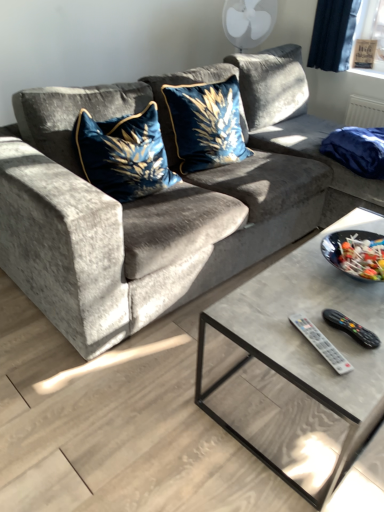
What do you see at coordinates (321, 343) in the screenshot? This screenshot has height=512, width=384. I see `white plastic remote at lower right, arranged as the first remote when viewed from the left` at bounding box center [321, 343].

Describe the element at coordinates (206, 124) in the screenshot. I see `velvet blue cushion at center, arranged as the second throw pillow when viewed from the left` at that location.

This screenshot has width=384, height=512. What do you see at coordinates (124, 154) in the screenshot?
I see `velvet blue pillow at center, the first throw pillow from the left` at bounding box center [124, 154].

This screenshot has width=384, height=512. In order to click on black plastic remote at lower right, which is counted as the first remote, starting from the right in this screenshot , I will do `click(351, 328)`.

Find the location of a particular element. This screenshot has width=384, height=512. white plastic remote at lower right, the 2th remote viewed from the right is located at coordinates (321, 343).

From a real-world perspective, is velvet blue pillow at center, the first throw pillow from the left, under black plastic remote at lower right, which is counted as the first remote, starting from the right?

Incorrect, from a real-world perspective, velvet blue pillow at center, the first throw pillow from the left, is higher than black plastic remote at lower right, which is counted as the first remote, starting from the right.

Is velvet blue pillow at center, which is the 2th throw pillow from right to left, wider or thinner than black plastic remote at lower right, marked as the second remote in a left-to-right arrangement?

velvet blue pillow at center, which is the 2th throw pillow from right to left, is wider than black plastic remote at lower right, marked as the second remote in a left-to-right arrangement.

Does velvet blue pillow at center, the first throw pillow from the left, appear on the right side of black plastic remote at lower right, which is counted as the first remote, starting from the right?

No, velvet blue pillow at center, the first throw pillow from the left, is not to the right of black plastic remote at lower right, which is counted as the first remote, starting from the right.

How different are the orientations of white plastic remote at lower right, arranged as the first remote when viewed from the left, and velvet blue pillow at center, the first throw pillow from the left, in degrees?

white plastic remote at lower right, arranged as the first remote when viewed from the left, and velvet blue pillow at center, the first throw pillow from the left, are facing 9.22 degrees away from each other.

Can you confirm if white plastic remote at lower right, the 2th remote viewed from the right, is thinner than velvet blue pillow at center, which is the 2th throw pillow from right to left?

Yes, white plastic remote at lower right, the 2th remote viewed from the right, is thinner than velvet blue pillow at center, which is the 2th throw pillow from right to left.

From the image's perspective, is white plastic remote at lower right, arranged as the first remote when viewed from the left, above or below velvet blue pillow at center, which is the 2th throw pillow from right to left?

Clearly, from the image's perspective, white plastic remote at lower right, arranged as the first remote when viewed from the left, is below velvet blue pillow at center, which is the 2th throw pillow from right to left.

Is white plastic remote at lower right, the 2th remote viewed from the right, positioned far away from velvet blue pillow at center, which is the 2th throw pillow from right to left?

white plastic remote at lower right, the 2th remote viewed from the right, is positioned a significant distance from velvet blue pillow at center, which is the 2th throw pillow from right to left.

From the image's perspective, which object appears higher, velvet gray couch at center or velvet blue pillow at center, which is the 2th throw pillow from right to left?

velvet blue pillow at center, which is the 2th throw pillow from right to left, appears higher in the image.

Is velvet gray couch at center further to camera compared to velvet blue pillow at center, the first throw pillow from the left?

No, velvet gray couch at center is in front of velvet blue pillow at center, the first throw pillow from the left.

Is velvet gray couch at center in contact with velvet blue pillow at center, the first throw pillow from the left?

There is a gap between velvet gray couch at center and velvet blue pillow at center, the first throw pillow from the left.

How far apart are velvet gray couch at center and velvet blue pillow at center, the first throw pillow from the left?

12.36 inches.

From the image's perspective, is white plastic remote at lower right, the 2th remote viewed from the right, below velvet blue cushion at center, arranged as the second throw pillow when viewed from the left?

Yes, from the image's perspective, white plastic remote at lower right, the 2th remote viewed from the right, is below velvet blue cushion at center, arranged as the second throw pillow when viewed from the left.

Considering the points (313, 329) and (176, 134), which point is in front, point (313, 329) or point (176, 134)?

The point (313, 329) is closer to the camera.

Is white plastic remote at lower right, the 2th remote viewed from the right, not close to velvet blue cushion at center, arranged as the second throw pillow when viewed from the left?

That's right, there is a large distance between white plastic remote at lower right, the 2th remote viewed from the right, and velvet blue cushion at center, arranged as the second throw pillow when viewed from the left.

From a real-world perspective, between white plastic remote at lower right, arranged as the first remote when viewed from the left, and velvet blue cushion at center, arranged as the second throw pillow when viewed from the left, who is vertically higher?

velvet blue cushion at center, arranged as the second throw pillow when viewed from the left, is physically above.

Is velvet gray couch at center positioned with its back to velvet blue pillow at upper right?

That's not correct — velvet gray couch at center is not looking away from velvet blue pillow at upper right.

Where is `studio couch below the velvet blue pillow at upper right (from a real-world perspective)`? This screenshot has height=512, width=384. studio couch below the velvet blue pillow at upper right (from a real-world perspective) is located at coordinates (162, 200).

From a real-world perspective, between velvet gray couch at center and velvet blue pillow at upper right, who is vertically lower?

In real-world perspective, velvet gray couch at center is lower.

Does point (307, 91) come farther from viewer compared to point (337, 158)?

Yes.

From a real-world perspective, relative to velvet gray couch at center, is white plastic remote at lower right, arranged as the first remote when viewed from the left, vertically above or below?

white plastic remote at lower right, arranged as the first remote when viewed from the left, is situated lower than velvet gray couch at center in the real world.

Is white plastic remote at lower right, arranged as the first remote when viewed from the left, situated inside velvet gray couch at center or outside?

white plastic remote at lower right, arranged as the first remote when viewed from the left, is located beyond the bounds of velvet gray couch at center.

From the image's perspective, relative to velvet gray couch at center, is white plastic remote at lower right, the 2th remote viewed from the right, above or below?

From the image's perspective, white plastic remote at lower right, the 2th remote viewed from the right, appears below velvet gray couch at center.

What are the coordinates of `the 1st throw pillow above when counting from the velvet gray couch at center (from the image's perspective)` in the screenshot? It's located at (124, 154).

From a real-world perspective, which is physically above, velvet blue pillow at center, which is the 2th throw pillow from right to left, or velvet gray couch at center?

From a 3D spatial view, velvet blue pillow at center, which is the 2th throw pillow from right to left, is above.

Between point (137, 127) and point (302, 191), which one is positioned in front?

The point (137, 127) is closer to the camera.

From the image's perspective, is velvet blue pillow at center, the first throw pillow from the left, under velvet gray couch at center?

No, from the image's perspective, velvet blue pillow at center, the first throw pillow from the left, is not beneath velvet gray couch at center.

The width and height of the screenshot is (384, 512). I want to click on throw pillow that is the 2nd object to the left of the black plastic remote at lower right, which is counted as the first remote, starting from the right, starting at the anchor, so click(124, 154).

From a real-world perspective, count 1st throw pillows upward from the white plastic remote at lower right, the 2th remote viewed from the right, and point to it. Please provide its 2D coordinates.

[(124, 154)]

Considering their positions, is velvet blue pillow at center, which is the 2th throw pillow from right to left, positioned further to black plastic remote at lower right, which is counted as the first remote, starting from the right, than velvet blue pillow at upper right?

velvet blue pillow at upper right is further to black plastic remote at lower right, which is counted as the first remote, starting from the right.

In the scene shown: When comparing their distances from velvet blue cushion at center, the 1th throw pillow positioned from the right, does velvet blue pillow at center, which is the 2th throw pillow from right to left, or velvet blue pillow at upper right seem further?

velvet blue pillow at upper right is further to velvet blue cushion at center, the 1th throw pillow positioned from the right.

Estimate the real-world distances between objects in this image. Which object is further from white plastic remote at lower right, the 2th remote viewed from the right, velvet blue pillow at upper right or velvet blue cushion at center, arranged as the second throw pillow when viewed from the left?

velvet blue pillow at upper right.

Based on their spatial positions, is velvet gray couch at center or velvet blue pillow at upper right further from velvet blue pillow at center, the first throw pillow from the left?

velvet blue pillow at upper right.

Looking at this image, estimate the real-world distances between objects in this image. Which object is closer to velvet blue pillow at center, which is the 2th throw pillow from right to left, velvet gray couch at center or white plastic remote at lower right, arranged as the first remote when viewed from the left?

velvet gray couch at center is closer to velvet blue pillow at center, which is the 2th throw pillow from right to left.

When comparing their distances from velvet blue cushion at center, arranged as the second throw pillow when viewed from the left, does velvet blue pillow at center, the first throw pillow from the left, or velvet gray couch at center seem closer?

Among the two, velvet gray couch at center is located nearer to velvet blue cushion at center, arranged as the second throw pillow when viewed from the left.

Considering their positions, is black plastic remote at lower right, marked as the second remote in a left-to-right arrangement, positioned further to velvet blue pillow at center, the first throw pillow from the left, than velvet blue pillow at upper right?

black plastic remote at lower right, marked as the second remote in a left-to-right arrangement.

Which object lies further to the anchor point velvet blue pillow at upper right, velvet blue pillow at center, the first throw pillow from the left, or velvet gray couch at center?

velvet blue pillow at center, the first throw pillow from the left.

Locate an element on the screen. pillow that lies between velvet blue cushion at center, the 1th throw pillow positioned from the right, and black plastic remote at lower right, which is counted as the first remote, starting from the right, from top to bottom is located at coordinates (357, 150).

The image size is (384, 512). I want to click on throw pillow between velvet gray couch at center and velvet blue cushion at center, arranged as the second throw pillow when viewed from the left, from front to back, so click(124, 154).

I want to click on remote between velvet blue cushion at center, the 1th throw pillow positioned from the right, and white plastic remote at lower right, arranged as the first remote when viewed from the left, in the up-down direction, so click(351, 328).

The width and height of the screenshot is (384, 512). I want to click on remote between white plastic remote at lower right, the 2th remote viewed from the right, and velvet blue pillow at upper right from front to back, so click(x=351, y=328).